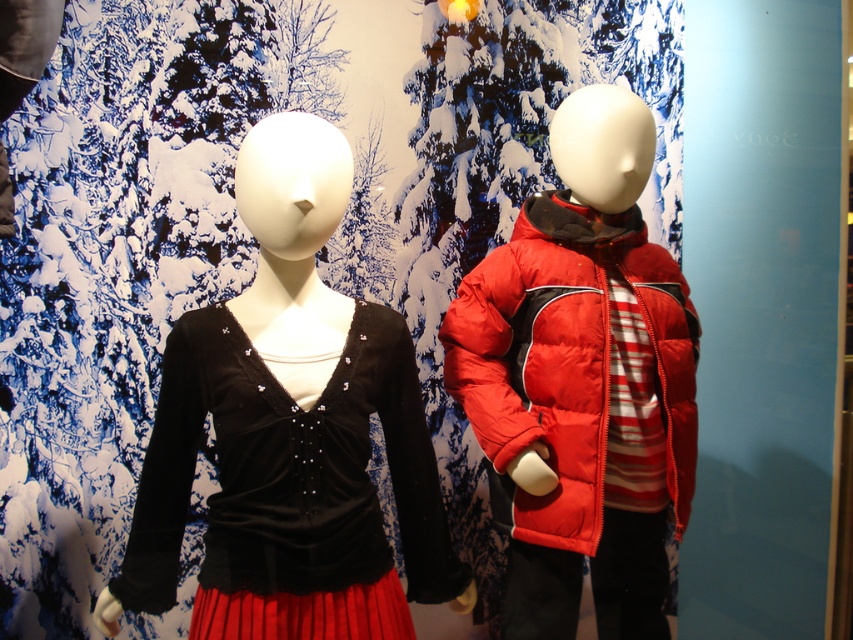
Where is `velvet black top at center`? velvet black top at center is located at coordinates (291, 432).

This screenshot has height=640, width=853. Find the location of `velvet black top at center`. velvet black top at center is located at coordinates (291, 432).